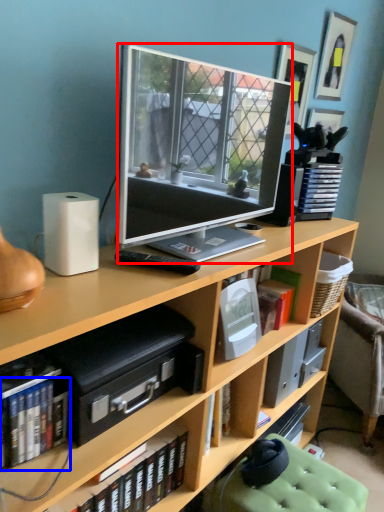
Question: Which object appears farthest to the camera in this image, television (highlighted by a red box) or book (highlighted by a blue box)?

Choices:
 (A) television
 (B) book

Answer: (B)